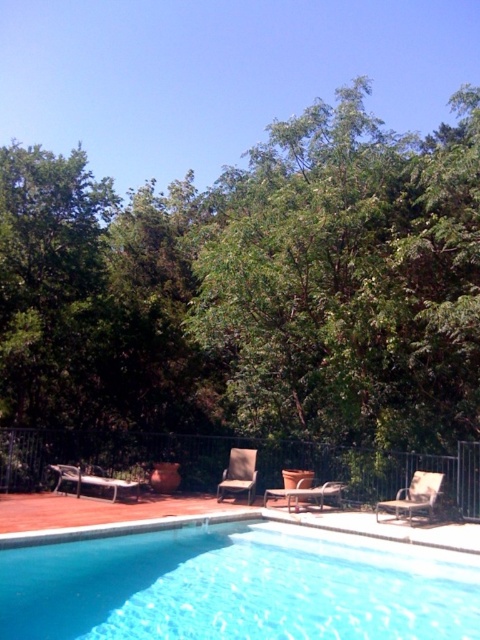
You are standing on the wooden deck near the swimming pool and want to place a small potted plant between the two points labeled point (9, 636) and point (240, 452). Which point should the plant be closer to if it needs to be nearer to the lounge chairs?

The plant should be placed closer to point (9, 636) because it is closer to the viewer, which is where the lounge chairs are located.

You are planning to place a new bench in the outdoor area shown. The bench is 1.5 meters long. You want to place it near the black metal fence at lower center and the brown woven wicker chair at lower right. Based on their sizes, will the bench fit between them without being too cramped?

The black metal fence at lower center is bigger than the brown woven wicker chair at lower right. Since the bench is 1.5 meters long, it might fit between them, but the exact spacing depends on the actual dimensions of the fence and chair. However, since the fence is larger, there might be enough space for the bench to fit comfortably.

You are planning to place a new bench in the area between the green leafy tree at upper center and the matte brown lounge chair at center. Considering their sizes, which object will the bench be closer to?

The bench should be placed closer to the matte brown lounge chair at center because the green leafy tree at upper center is bigger, so there might be more space near the smaller lounge chair.